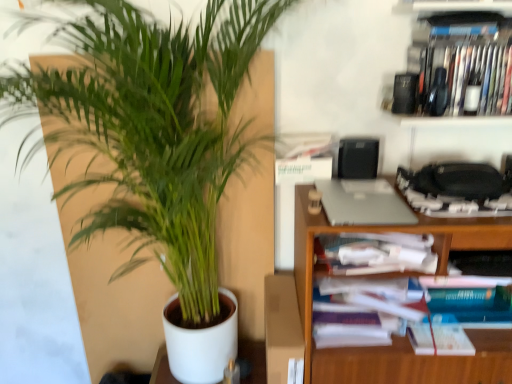
Locate an element on the screen. This screenshot has width=512, height=384. free spot above silver metallic laptop at upper right (from a real-world perspective) is located at coordinates (361, 199).